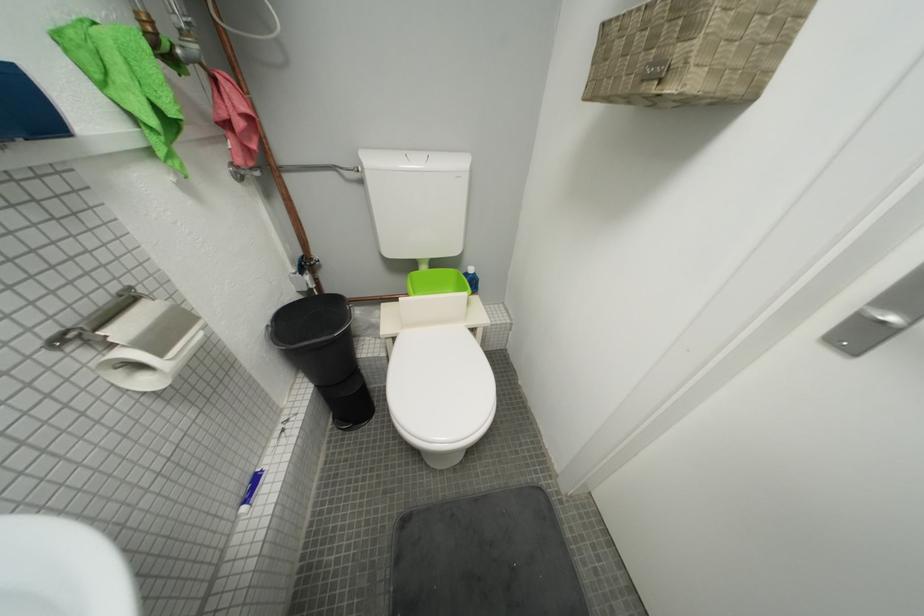
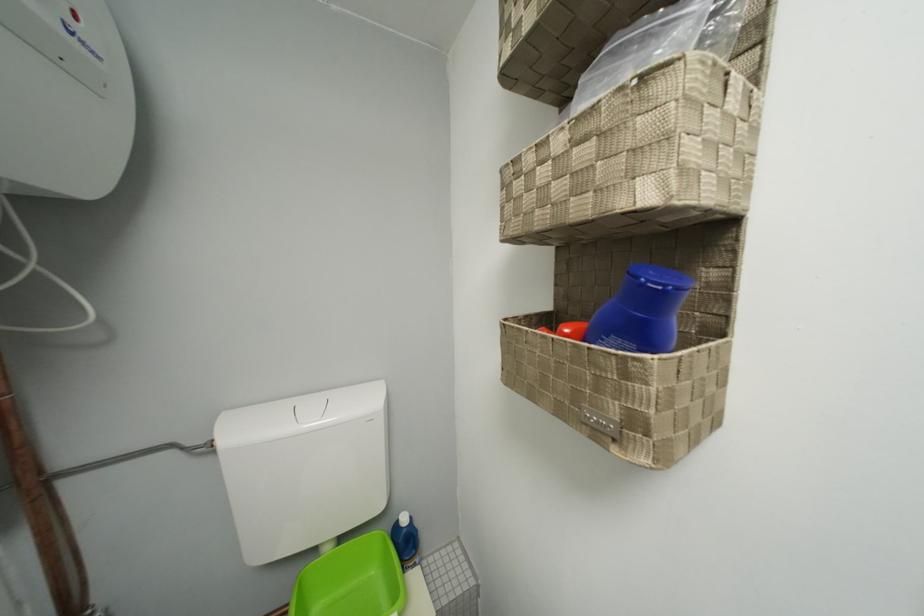
The first image is from the beginning of the video and the second image is from the end. How did the camera likely rotate when shooting the video?

The rotation direction of the camera is right-up.